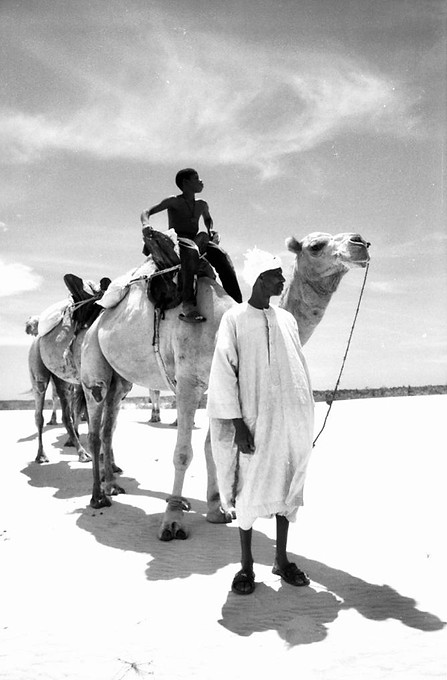
This screenshot has width=447, height=680. Identify the location of floor. (336, 606).